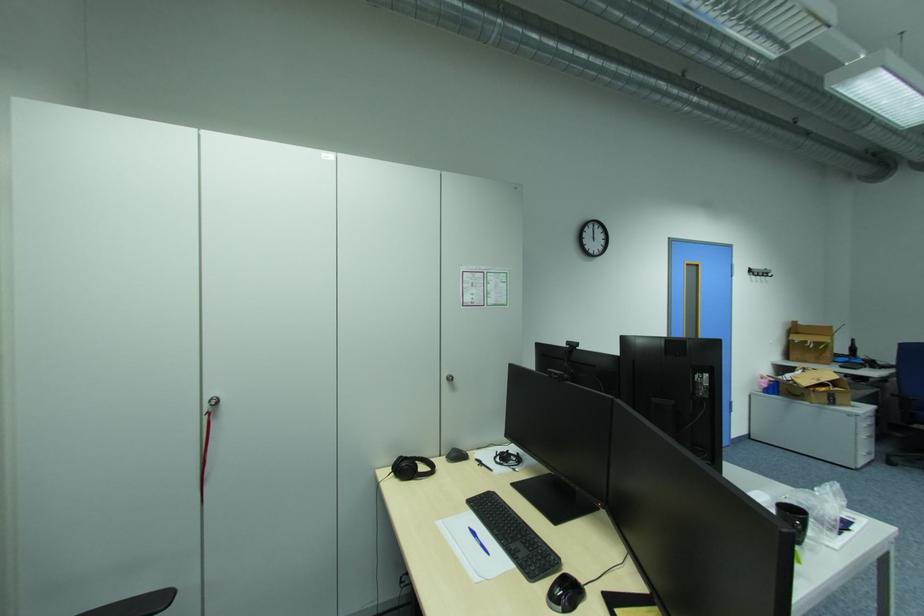
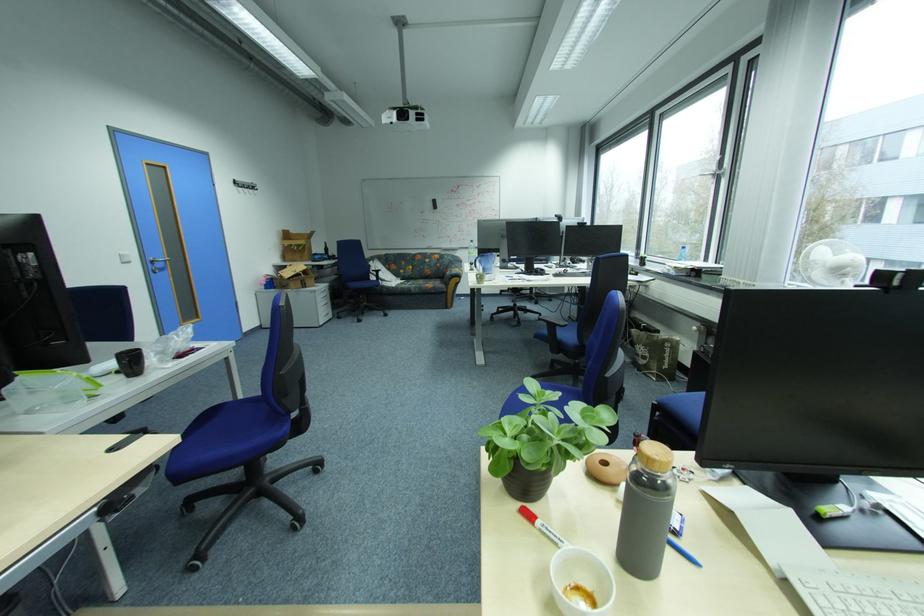
Question: Based on the continuous images, in which direction is the camera rotating? Reply with the corresponding letter.

Choices:
 (A) Left
 (B) Right
 (C) Up
 (D) Down

Answer: (B)